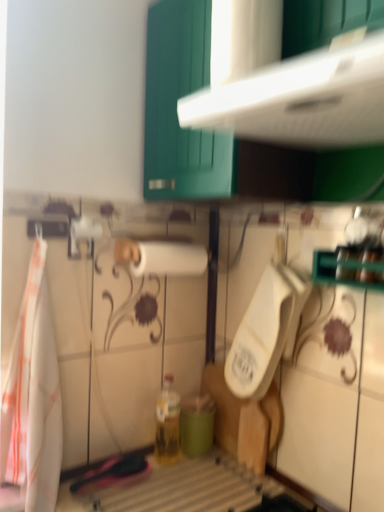
The height and width of the screenshot is (512, 384). What do you see at coordinates (33, 397) in the screenshot? I see `white fabric towel at left` at bounding box center [33, 397].

The height and width of the screenshot is (512, 384). What do you see at coordinates (167, 424) in the screenshot? I see `translucent glass bottle at center` at bounding box center [167, 424].

Where is `white plastic cabinet at upper center`? The image size is (384, 512). white plastic cabinet at upper center is located at coordinates (229, 135).

You are a GUI agent. You are given a task and a screenshot of the screen. Output one action in this format:
    pyautogui.click(x=<x>, y=<y>)
    Task: Click on the white plastic urinal at center
    The image size is (384, 512).
    Given the screenshot: What is the action you would take?
    pyautogui.click(x=265, y=331)

At what (x,y) coordinates should I click in order to perform the action: click on teal matte cup at lower center. Please return your answer as a coordinate pair (x, y). This screenshot has height=512, width=384. Looking at the image, I should click on (196, 424).

Which of these two, white fabric towel at left or white matte paper towel at center, is wider?

white fabric towel at left is wider.

Are white fabric towel at left and white matte paper towel at center located far from each other?

No, there isn't a large distance between white fabric towel at left and white matte paper towel at center.

Is white fabric towel at left taller than white matte paper towel at center?

Indeed, white fabric towel at left has a greater height compared to white matte paper towel at center.

Is point (46, 391) more distant than point (138, 273)?

No, it is not.

Can you confirm if white fabric towel at left is wider than translucent glass bottle at center?

Yes.

Does white fabric towel at left lie in front of translucent glass bottle at center?

Yes, it is.

Measure the distance from white fabric towel at left to translucent glass bottle at center.

white fabric towel at left and translucent glass bottle at center are 16.82 inches apart.

Considering the relative positions of white fabric towel at left and translucent glass bottle at center in the image provided, is white fabric towel at left to the left of translucent glass bottle at center from the viewer's perspective?

Indeed, white fabric towel at left is positioned on the left side of translucent glass bottle at center.

From their relative heights in the image, would you say white matte paper towel at center is taller or shorter than white plastic urinal at center?

Considering their sizes, white matte paper towel at center has less height than white plastic urinal at center.

Does white matte paper towel at center turn towards white plastic urinal at center?

No, white matte paper towel at center does not turn towards white plastic urinal at center.

How much distance is there between white matte paper towel at center and white plastic urinal at center?

white matte paper towel at center is 11.84 inches from white plastic urinal at center.

From the image's perspective, which is below, white matte paper towel at center or white plastic urinal at center?

white plastic urinal at center.

Which is behind, white fabric towel at left or white plastic urinal at center?

white plastic urinal at center is further away from the camera.

From the picture: How different are the orientations of white fabric towel at left and white plastic urinal at center in degrees?

The facing directions of white fabric towel at left and white plastic urinal at center are 91.4 degrees apart.

Does point (40, 353) lie in front of point (299, 312)?

Yes, it is.

Is white fabric towel at left directly adjacent to white plastic urinal at center?

There is a gap between white fabric towel at left and white plastic urinal at center.

Is white matte paper towel at center shorter than teal matte cup at lower center?

Correct, white matte paper towel at center is not as tall as teal matte cup at lower center.

Would you say white matte paper towel at center is to the left or to the right of teal matte cup at lower center in the picture?

Based on their positions, white matte paper towel at center is located to the left of teal matte cup at lower center.

Does white matte paper towel at center turn towards teal matte cup at lower center?

No.

Would you say white matte paper towel at center is a long distance from teal matte cup at lower center?

No.

Is white matte paper towel at center next to white plastic cabinet at upper center?

No, white matte paper towel at center is not touching white plastic cabinet at upper center.

Looking at this image, which object is positioned more to the left, white matte paper towel at center or white plastic cabinet at upper center?

From the viewer's perspective, white matte paper towel at center appears more on the left side.

In terms of width, does white matte paper towel at center look wider or thinner when compared to white plastic cabinet at upper center?

Considering their sizes, white matte paper towel at center looks slimmer than white plastic cabinet at upper center.

Can you tell me how much white matte paper towel at center and white plastic cabinet at upper center differ in facing direction?

white matte paper towel at center and white plastic cabinet at upper center are facing 88.9 degrees away from each other.

Is point (155, 243) closer or farther from the camera than point (167, 445)?

Point (155, 243) appears to be closer to the viewer than point (167, 445).

Can you confirm if white matte paper towel at center is bigger than translucent glass bottle at center?

Yes.

Is white matte paper towel at center further to the viewer compared to translucent glass bottle at center?

No, white matte paper towel at center is in front of translucent glass bottle at center.

Can you confirm if white matte paper towel at center is wider than translucent glass bottle at center?

Indeed, white matte paper towel at center has a greater width compared to translucent glass bottle at center.

Find the location of `beach towel on the left of white matte paper towel at center`. beach towel on the left of white matte paper towel at center is located at coordinates (33, 397).

This screenshot has height=512, width=384. Identify the location of bottle on the right of white fabric towel at left. (167, 424).

Looking at the image, which one is located closer to white plastic urinal at center, teal matte cup at lower center or white matte paper towel at center?

white matte paper towel at center is closer to white plastic urinal at center.

Looking at the image, which one is located further to teal matte cup at lower center, white matte paper towel at center or white plastic urinal at center?

white matte paper towel at center is positioned further to the anchor teal matte cup at lower center.

Looking at the image, which one is located closer to translucent glass bottle at center, teal matte cup at lower center or white plastic urinal at center?

teal matte cup at lower center is closer to translucent glass bottle at center.

Estimate the real-world distances between objects in this image. Which object is further from white plastic urinal at center, translucent glass bottle at center or teal matte cup at lower center?

translucent glass bottle at center lies further to white plastic urinal at center than the other object.

Which object lies further to the anchor point white fabric towel at left, teal matte cup at lower center or white matte paper towel at center?

teal matte cup at lower center.

Estimate the real-world distances between objects in this image. Which object is further from white matte paper towel at center, white plastic urinal at center or white fabric towel at left?

white fabric towel at left is further to white matte paper towel at center.

Based on the photo, which object lies nearer to the anchor point translucent glass bottle at center, white fabric towel at left or white plastic cabinet at upper center?

The object closer to translucent glass bottle at center is white fabric towel at left.

Considering their positions, is white matte paper towel at center positioned further to white plastic cabinet at upper center than teal matte cup at lower center?

teal matte cup at lower center.

Where is `bottle between white fabric towel at left and white plastic urinal at center in the horizontal direction`? bottle between white fabric towel at left and white plastic urinal at center in the horizontal direction is located at coordinates (167, 424).

Identify the location of urinal that lies between white matte paper towel at center and translucent glass bottle at center from top to bottom. (265, 331).

You are a GUI agent. You are given a task and a screenshot of the screen. Output one action in this format:
    pyautogui.click(x=<x>, y=<y>)
    Task: Click on the beach towel that lies between white matte paper towel at center and translucent glass bottle at center from top to bottom
    The image size is (384, 512).
    Given the screenshot: What is the action you would take?
    pyautogui.click(x=33, y=397)

What are the coordinates of `beach towel between white matte paper towel at center and teal matte cup at lower center from top to bottom` in the screenshot? It's located at (33, 397).